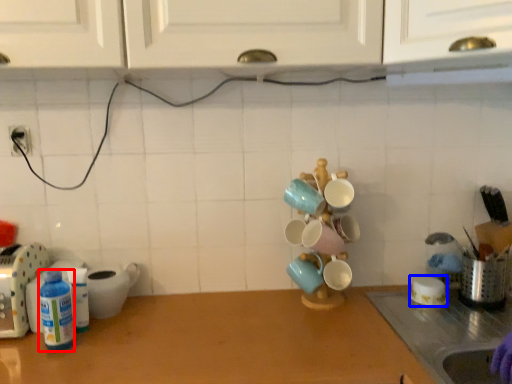
Question: Which object appears farthest to the camera in this image, bottle (highlighted by a red box) or tableware (highlighted by a blue box)?

Choices:
 (A) bottle
 (B) tableware

Answer: (B)